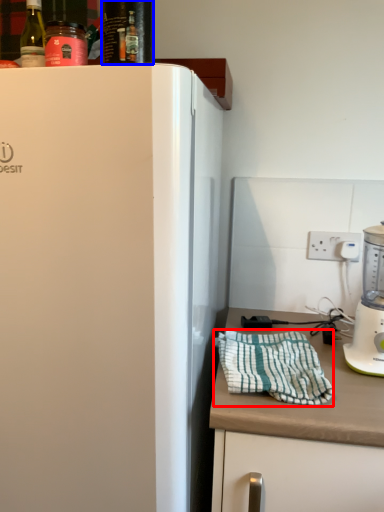
Question: Among these objects, which one is farthest to the camera, blanket (highlighted by a red box) or beverage (highlighted by a blue box)?

Choices:
 (A) blanket
 (B) beverage

Answer: (A)